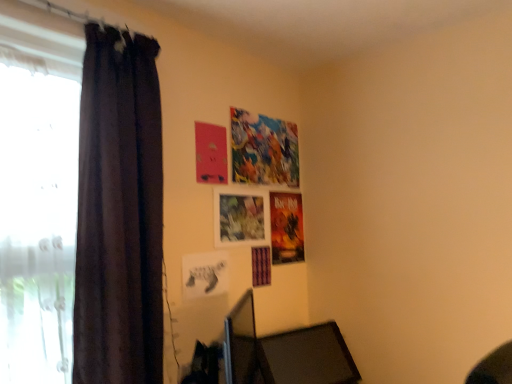
Question: Could matte paper poster at upper center be considered to be inside dark fabric curtain at left?

Choices:
 (A) no
 (B) yes

Answer: (A)

Question: Is dark fabric curtain at left not within matte paper poster at upper center?

Choices:
 (A) yes
 (B) no

Answer: (A)

Question: From the image's perspective, is dark fabric curtain at left above matte paper poster at upper center?

Choices:
 (A) no
 (B) yes

Answer: (A)

Question: Does dark fabric curtain at left have a smaller size compared to matte paper poster at upper center?

Choices:
 (A) no
 (B) yes

Answer: (A)

Question: Is dark fabric curtain at left to the left of matte paper poster at upper center from the viewer's perspective?

Choices:
 (A) no
 (B) yes

Answer: (B)

Question: From the image's perspective, relative to dark fabric curtain at left, is matte paper poster at upper center above or below?

Choices:
 (A) below
 (B) above

Answer: (B)

Question: Considering the positions of matte paper poster at upper center and dark fabric curtain at left in the image, is matte paper poster at upper center taller or shorter than dark fabric curtain at left?

Choices:
 (A) tall
 (B) short

Answer: (B)

Question: Considering the positions of matte paper poster at upper center and dark fabric curtain at left in the image, is matte paper poster at upper center wider or thinner than dark fabric curtain at left?

Choices:
 (A) wide
 (B) thin

Answer: (B)

Question: Is matte paper poster at upper center inside the boundaries of dark fabric curtain at left, or outside?

Choices:
 (A) inside
 (B) outside

Answer: (B)

Question: Considering the positions of white sheer curtain at left and black matte picture frame at center in the image, is white sheer curtain at left taller or shorter than black matte picture frame at center?

Choices:
 (A) short
 (B) tall

Answer: (B)

Question: Is white sheer curtain at left spatially inside black matte picture frame at center, or outside of it?

Choices:
 (A) outside
 (B) inside

Answer: (A)

Question: Considering their positions, is white sheer curtain at left located in front of or behind black matte picture frame at center?

Choices:
 (A) front
 (B) behind

Answer: (A)

Question: From a real-world perspective, is white sheer curtain at left above or below black matte picture frame at center?

Choices:
 (A) above
 (B) below

Answer: (A)

Question: Considering their positions, is dark fabric curtain at left located in front of or behind white sheer curtain at left?

Choices:
 (A) front
 (B) behind

Answer: (B)

Question: Visually, is dark fabric curtain at left positioned to the left or to the right of white sheer curtain at left?

Choices:
 (A) left
 (B) right

Answer: (B)